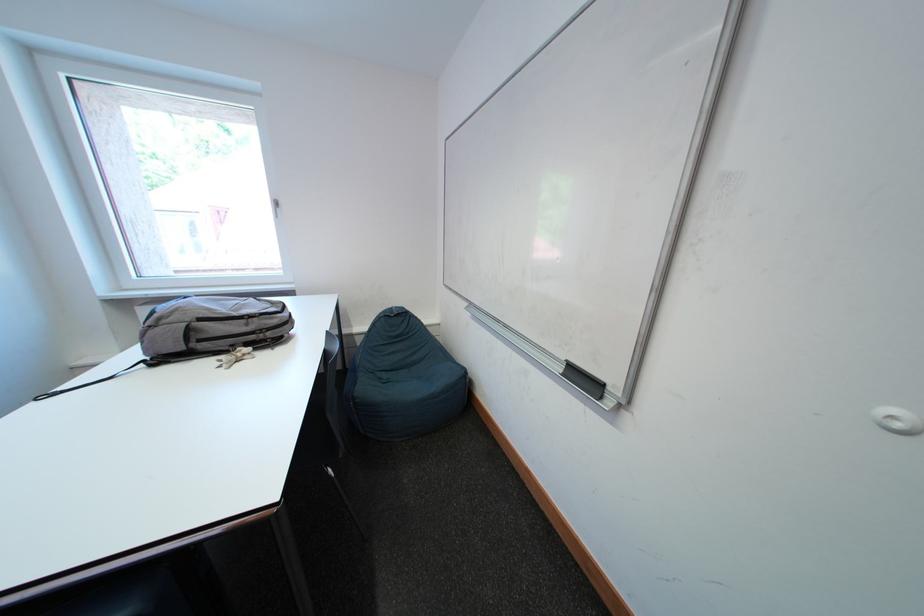
Describe the element at coordinates (275, 208) in the screenshot. I see `the window handle` at that location.